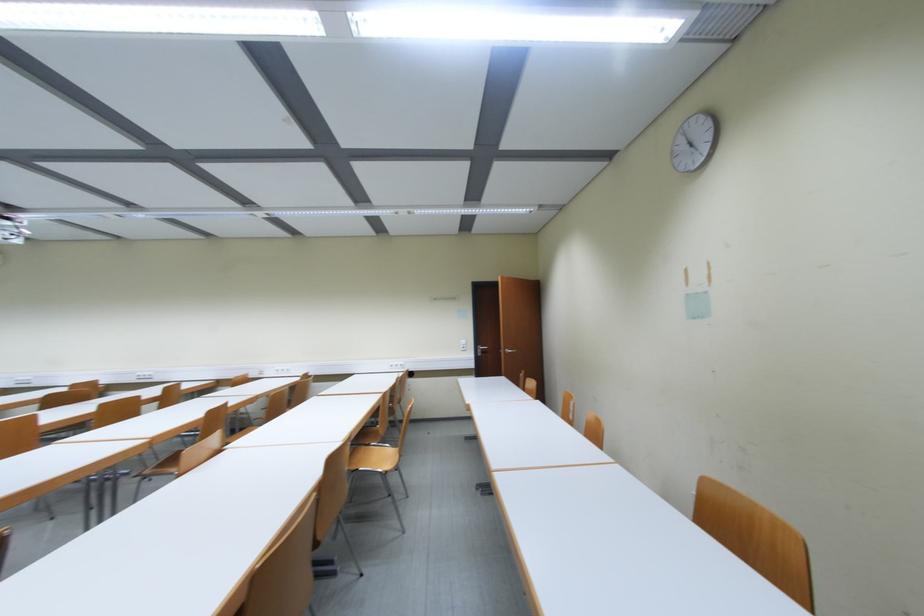
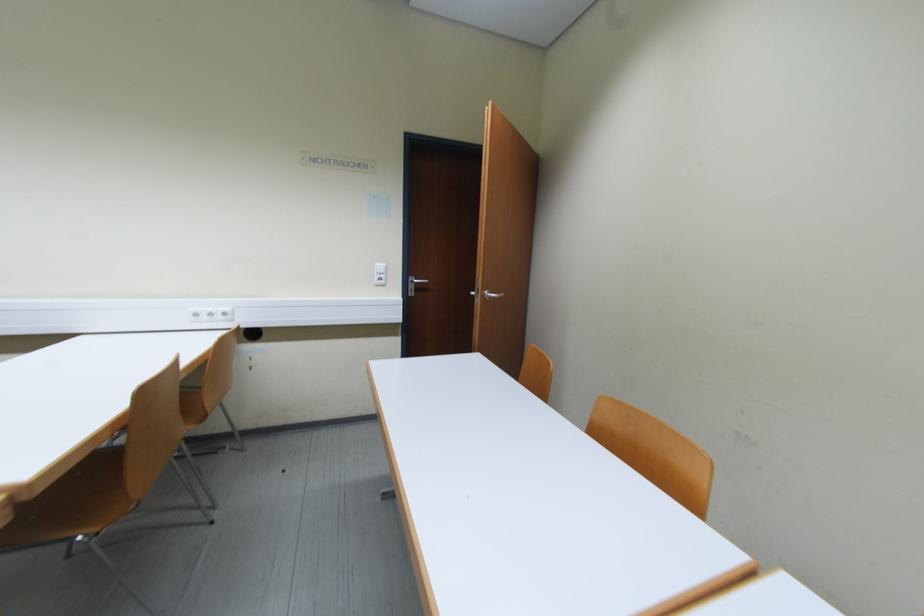
Question: In a continuous first-person perspective shot, in which direction is the camera moving?

Choices:
 (A) Left
 (B) Right
 (C) Forward
 (D) Backward

Answer: (C)